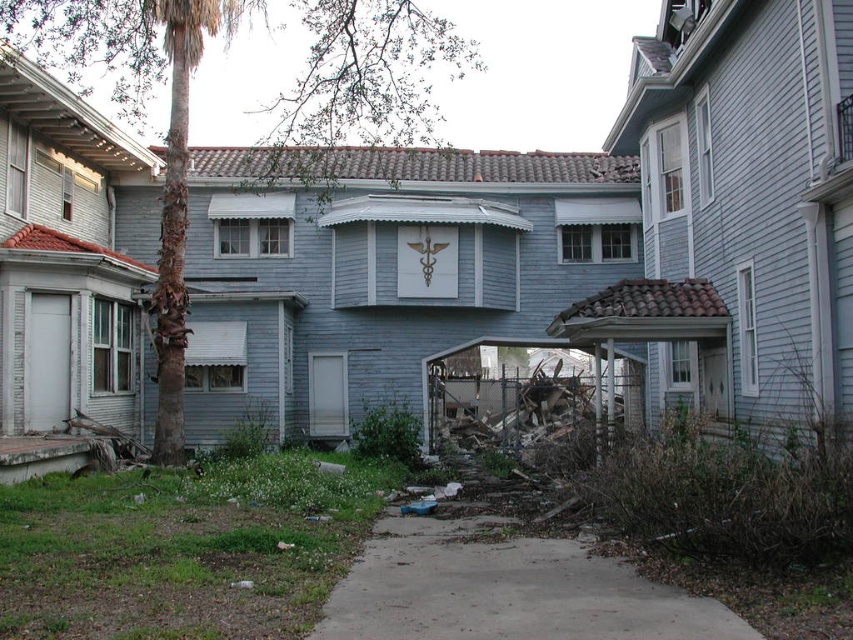
Question: Is gray concrete pavement at center positioned in front of brown/scaly bark palm tree at left?

Choices:
 (A) no
 (B) yes

Answer: (B)

Question: Does gray concrete pavement at center lie in front of brown/scaly bark palm tree at left?

Choices:
 (A) no
 (B) yes

Answer: (B)

Question: Can you confirm if gray concrete pavement at center is positioned below brown/scaly bark palm tree at left?

Choices:
 (A) yes
 (B) no

Answer: (A)

Question: Which point appears farthest from the camera in this image?

Choices:
 (A) (556, 605)
 (B) (173, 19)

Answer: (B)

Question: Which point is closer to the camera?

Choices:
 (A) brown/scaly bark palm tree at left
 (B) gray concrete pavement at center

Answer: (B)

Question: Which of the following is the farthest from the observer?

Choices:
 (A) (612, 582)
 (B) (142, 20)

Answer: (B)